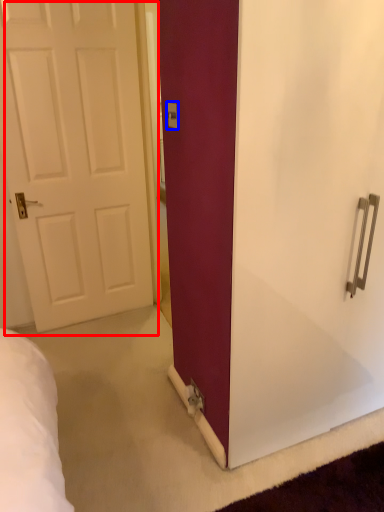
Question: Which object appears closest to the camera in this image, door (highlighted by a red box) or electric outlet (highlighted by a blue box)?

Choices:
 (A) door
 (B) electric outlet

Answer: (B)